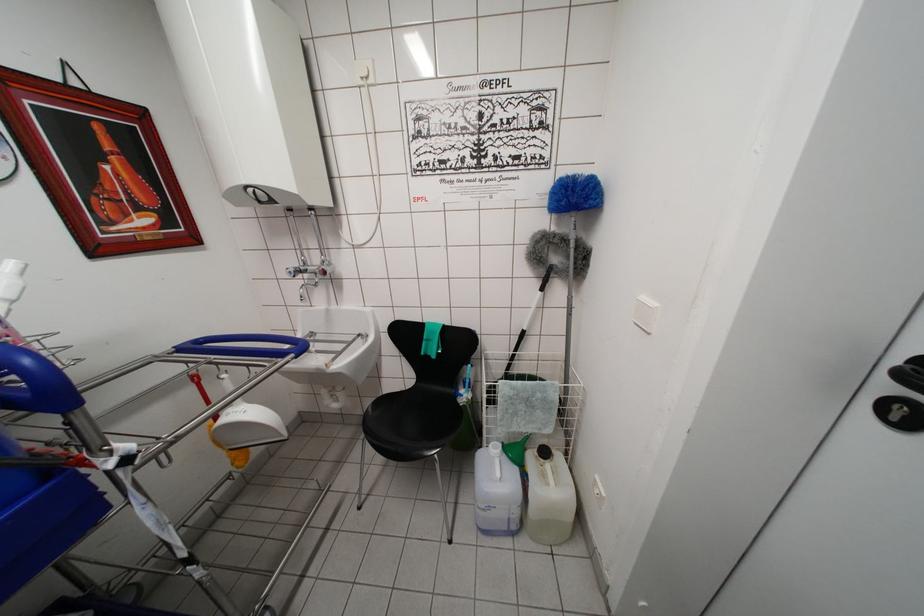
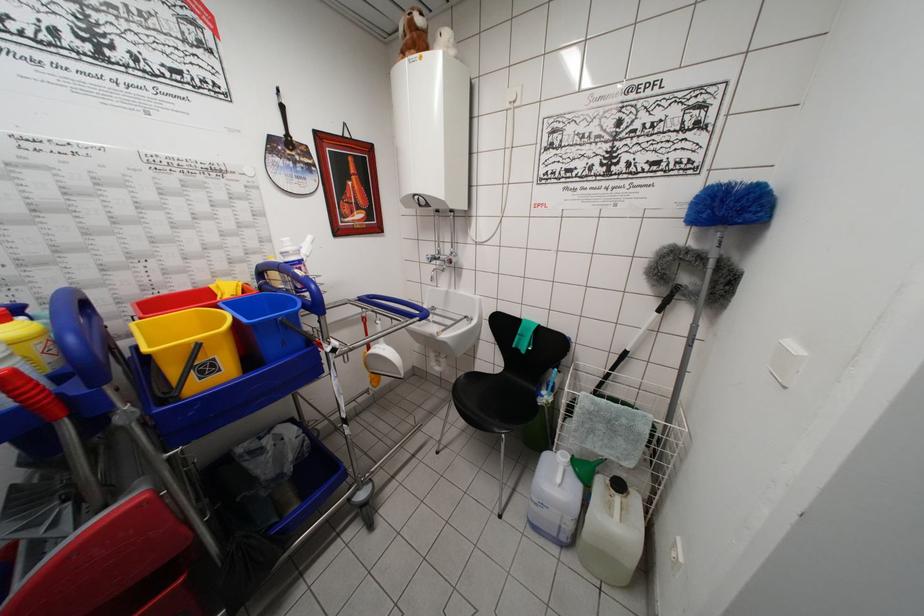
Locate, in the second image, the point that corresponds to point 518,354 in the first image.

(616, 374)